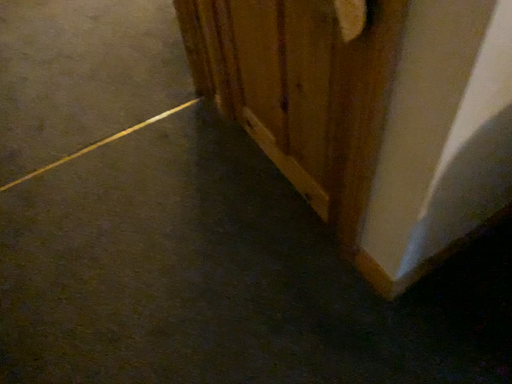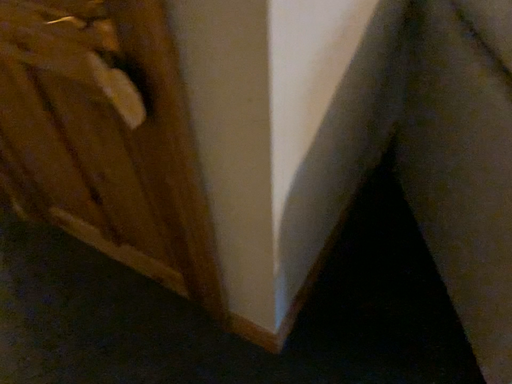
Question: Which way did the camera rotate in the video?

Choices:
 (A) rotated right
 (B) rotated left

Answer: (A)